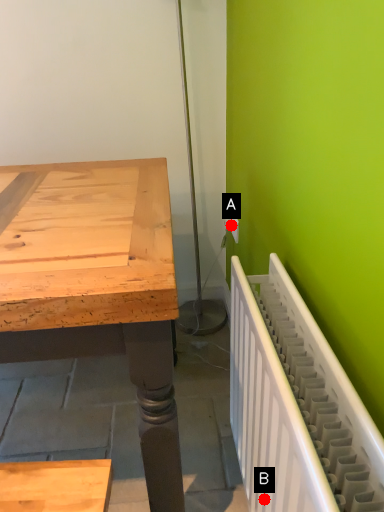
Question: Two points are circled on the image, labeled by A and B beside each circle. Which of the following is the farthest from the observer?

Choices:
 (A) A is further
 (B) B is further

Answer: (A)